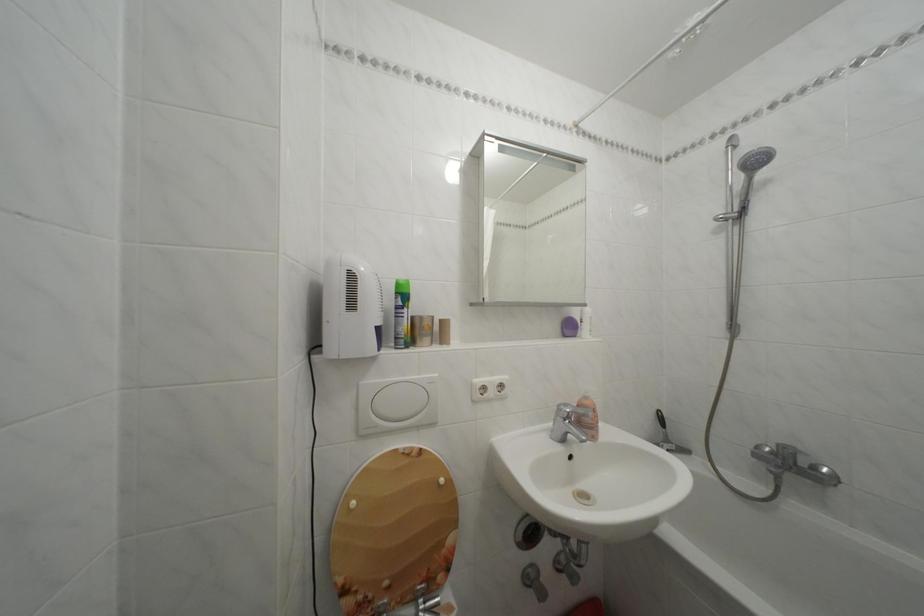
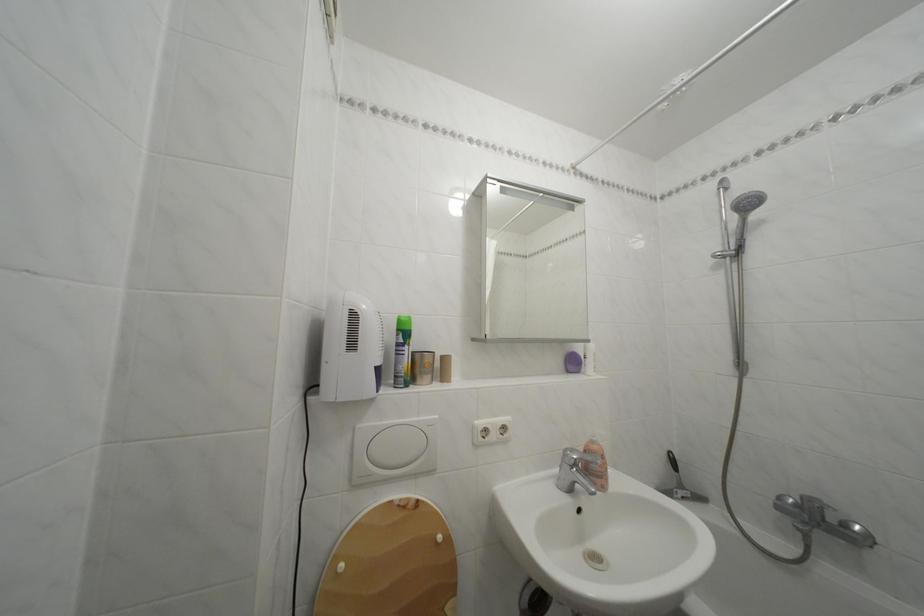
Find the pixel in the second image that matches (745,153) in the first image.

(736, 195)